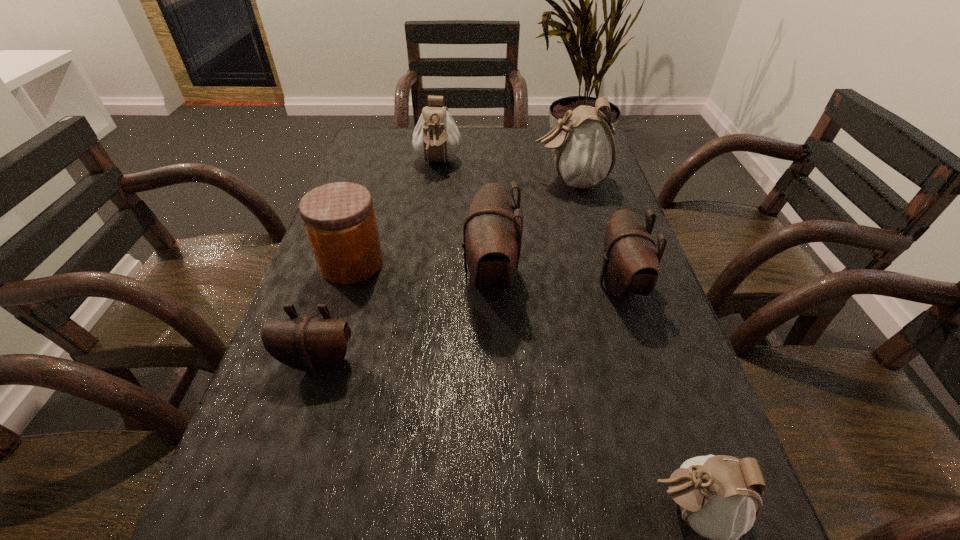
Point out which brown pouch is positioned as the nearest to the smallest white pouch. Please provide its 2D coordinates. Your answer should be formatted as a tuple, i.e. [(x, y)], where the tuple contains the x and y coordinates of a point satisfying the conditions above.

[(630, 266)]